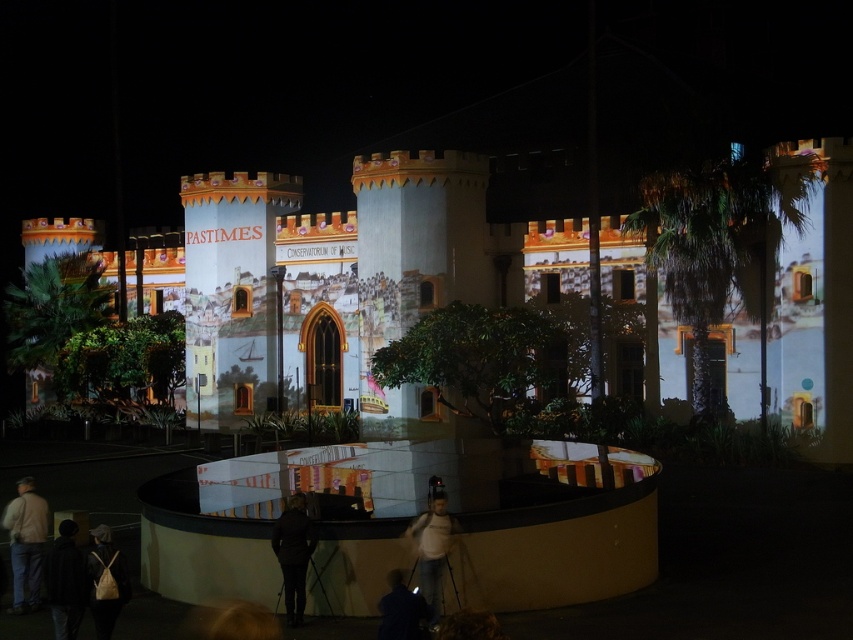
Question: Considering the real-world distances, which object is farthest from the white matte shirt at center?

Choices:
 (A) leather backpack at lower left
 (B) light beige jacket at lower left
 (C) dark brown leather jacket at center
 (D) matte white castle at center

Answer: (D)

Question: Which point appears farthest from the camera in this image?

Choices:
 (A) (776, 308)
 (B) (109, 588)
 (C) (440, 492)

Answer: (A)

Question: Does white matte shirt at center appear on the right side of leather backpack at lower left?

Choices:
 (A) no
 (B) yes

Answer: (B)

Question: Can you confirm if matte white castle at center is thinner than leather backpack at lower left?

Choices:
 (A) yes
 (B) no

Answer: (B)

Question: Observing the image, what is the correct spatial positioning of dark brown leather jacket at center in reference to leather backpack at lower left?

Choices:
 (A) above
 (B) below

Answer: (B)

Question: Which point appears closest to the camera in this image?

Choices:
 (A) (300, 561)
 (B) (444, 538)
 (C) (364, 353)
 (D) (109, 572)

Answer: (D)